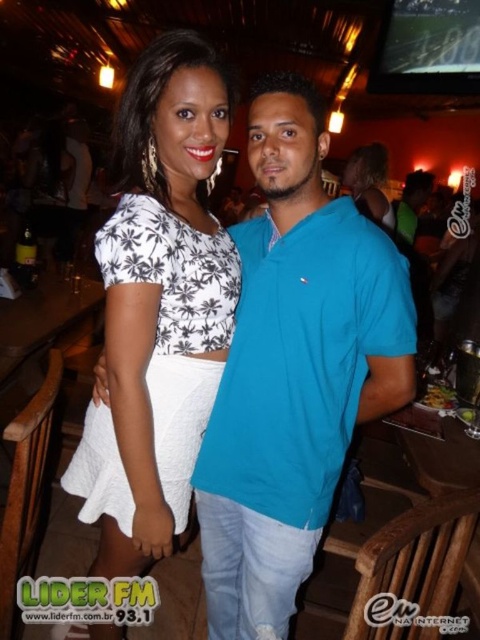
Question: Which point is farther to the camera?

Choices:
 (A) (276, 320)
 (B) (173, 332)

Answer: (B)

Question: In this image, where is white textured skirt at center located relative to matte black dress at center?

Choices:
 (A) left
 (B) right

Answer: (A)

Question: In this image, where is blue cotton shirt at center located relative to white textured skirt at center?

Choices:
 (A) below
 (B) above

Answer: (A)

Question: Based on their relative distances, which object is nearer to the matte black dress at center?

Choices:
 (A) blue cotton shirt at center
 (B) white textured skirt at center

Answer: (A)

Question: Which of these objects is positioned farthest from the white textured skirt at center?

Choices:
 (A) blue cotton shirt at center
 (B) matte black dress at center

Answer: (B)

Question: Is white textured skirt at center closer to the viewer compared to matte black dress at center?

Choices:
 (A) no
 (B) yes

Answer: (B)